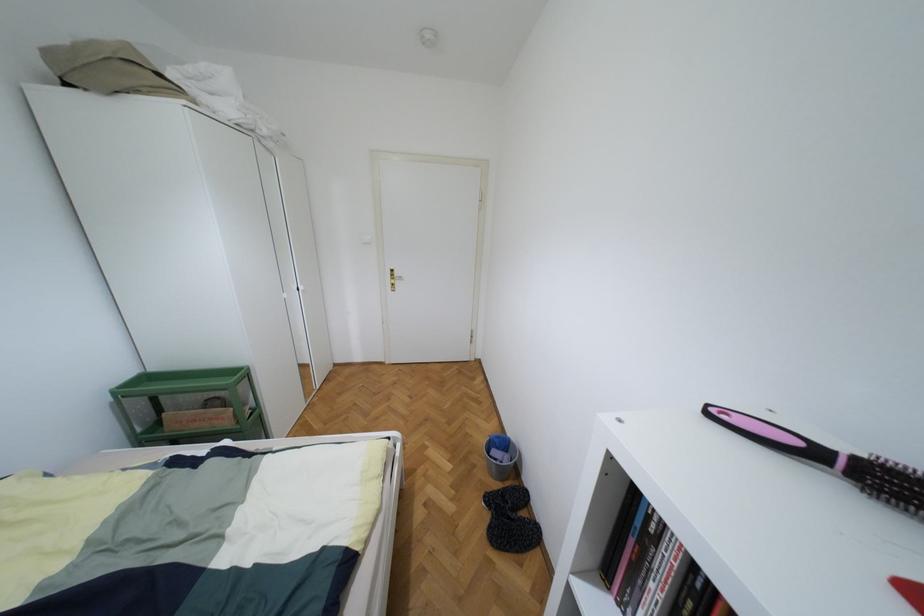
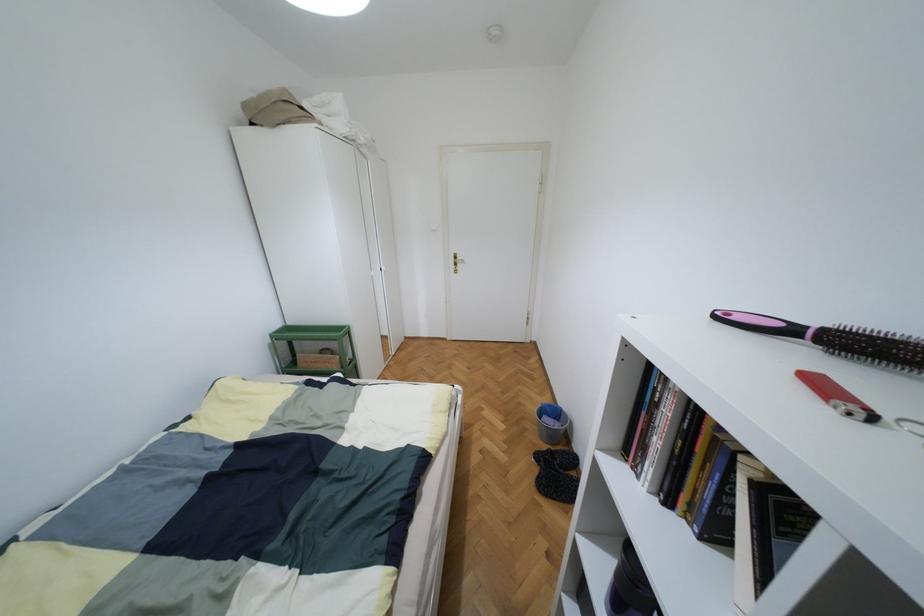
Locate, in the second image, the point that corresponds to pixel 395 274 in the first image.

(457, 257)